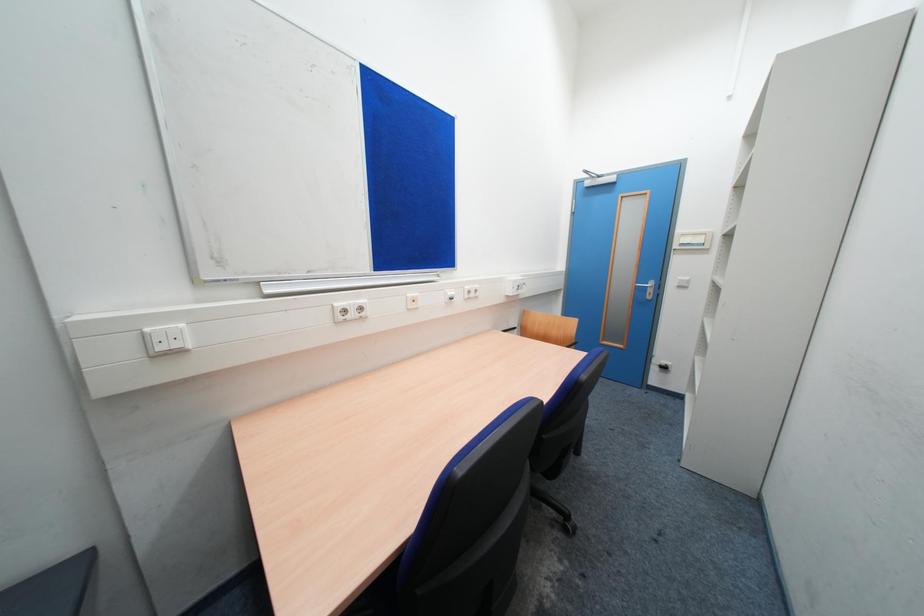
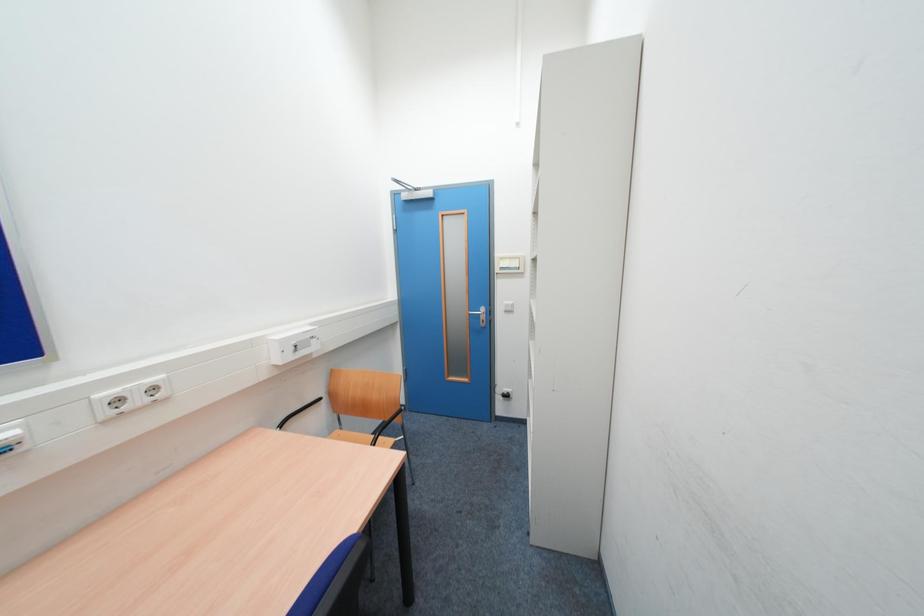
Based on the photo, which direction would the cameraman need to move to produce the second image?

The cameraman moved toward right, forward.